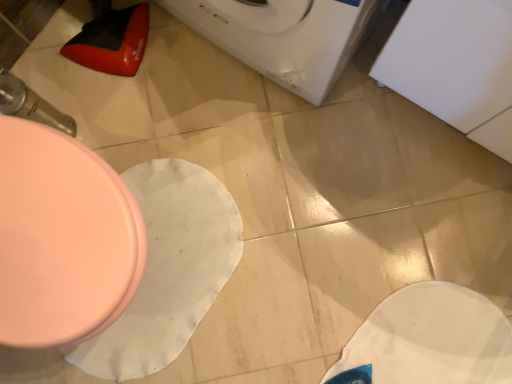
Question: Is white glossy washing machine at upper center outside matte pink toilet at left?

Choices:
 (A) no
 (B) yes

Answer: (B)

Question: Is white glossy washing machine at upper center to the right of matte pink toilet at left from the viewer's perspective?

Choices:
 (A) yes
 (B) no

Answer: (A)

Question: Can you confirm if white glossy washing machine at upper center is taller than matte pink toilet at left?

Choices:
 (A) yes
 (B) no

Answer: (A)

Question: Is white glossy washing machine at upper center in contact with matte pink toilet at left?

Choices:
 (A) no
 (B) yes

Answer: (A)

Question: Can you confirm if white glossy washing machine at upper center is shorter than matte pink toilet at left?

Choices:
 (A) no
 (B) yes

Answer: (A)

Question: From the image's perspective, is white glossy washing machine at upper center on top of matte pink toilet at left?

Choices:
 (A) yes
 (B) no

Answer: (A)

Question: Is the position of matte pink toilet at left more distant than that of white glossy washing machine at upper center?

Choices:
 (A) no
 (B) yes

Answer: (B)

Question: From the image's perspective, is matte pink toilet at left below white glossy washing machine at upper center?

Choices:
 (A) yes
 (B) no

Answer: (A)

Question: Is the surface of matte pink toilet at left in direct contact with white glossy washing machine at upper center?

Choices:
 (A) yes
 (B) no

Answer: (B)

Question: Is matte pink toilet at left outside of white glossy washing machine at upper center?

Choices:
 (A) no
 (B) yes

Answer: (B)

Question: Can you confirm if matte pink toilet at left is wider than white glossy washing machine at upper center?

Choices:
 (A) yes
 (B) no

Answer: (A)

Question: Can you confirm if matte pink toilet at left is taller than white glossy washing machine at upper center?

Choices:
 (A) yes
 (B) no

Answer: (B)

Question: From their relative heights in the image, would you say white glossy washing machine at upper center is taller or shorter than matte pink toilet at left?

Choices:
 (A) tall
 (B) short

Answer: (A)